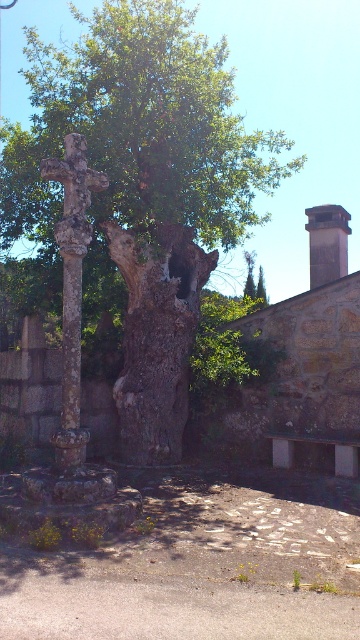
You are a park ranger examining the trees in the scene. You notice the green rough bark tree at center and the smooth brown tree trunk at center. Which one is located above the other?

The green rough bark tree at center is positioned over the smooth brown tree trunk at center, so it is located above the smooth brown tree trunk at center.